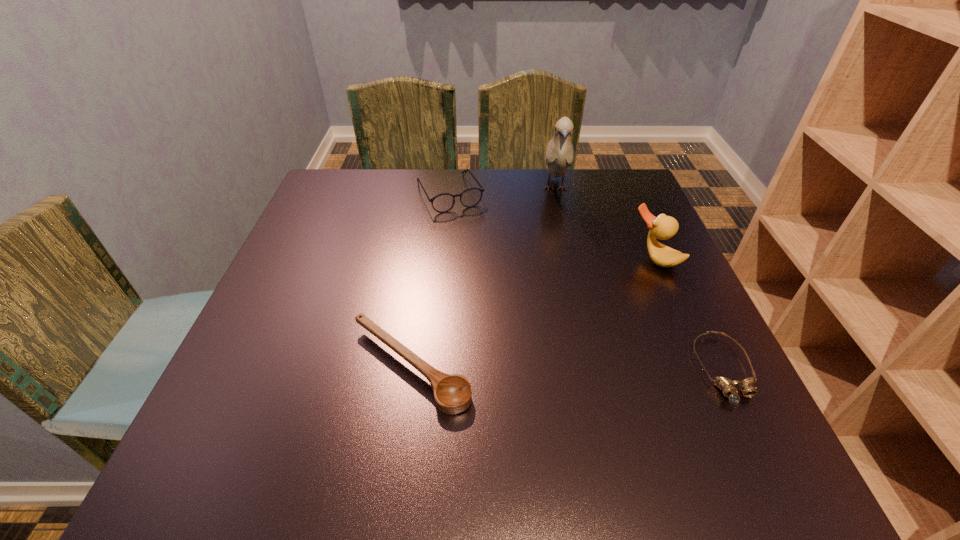
Find the location of a particular element. The width and height of the screenshot is (960, 540). the second shortest object is located at coordinates (452, 393).

You are a GUI agent. You are given a task and a screenshot of the screen. Output one action in this format:
    pyautogui.click(x=<x>, y=<y>)
    Task: Click on the goggles
    The height and width of the screenshot is (540, 960).
    Given the screenshot: What is the action you would take?
    pyautogui.click(x=728, y=387)

Image resolution: width=960 pixels, height=540 pixels. Find the location of `the fourth shortest object`. the fourth shortest object is located at coordinates (663, 227).

Locate an element on the screen. This screenshot has height=540, width=960. duck is located at coordinates (663, 227).

You are a GUI agent. You are given a task and a screenshot of the screen. Output one action in this format:
    pyautogui.click(x=<x>, y=<y>)
    Task: Click on the bird
    This screenshot has width=960, height=540.
    Given the screenshot: What is the action you would take?
    pyautogui.click(x=559, y=155)

The height and width of the screenshot is (540, 960). I want to click on the tallest object, so click(x=559, y=155).

In order to click on the third tallest object in this screenshot , I will do `click(442, 203)`.

Where is `free space located 0.230m on the right of the second shortest object`? Image resolution: width=960 pixels, height=540 pixels. free space located 0.230m on the right of the second shortest object is located at coordinates (599, 367).

Where is `vacant area situated 0.300m on the beak of the fourth shortest object`? This screenshot has width=960, height=540. vacant area situated 0.300m on the beak of the fourth shortest object is located at coordinates (564, 346).

You are a GUI agent. You are given a task and a screenshot of the screen. Output one action in this format:
    pyautogui.click(x=<x>, y=<y>)
    Task: Click on the vacant space located 0.300m on the beak of the fourth shortest object
    The image size is (960, 540).
    Given the screenshot: What is the action you would take?
    pyautogui.click(x=564, y=346)